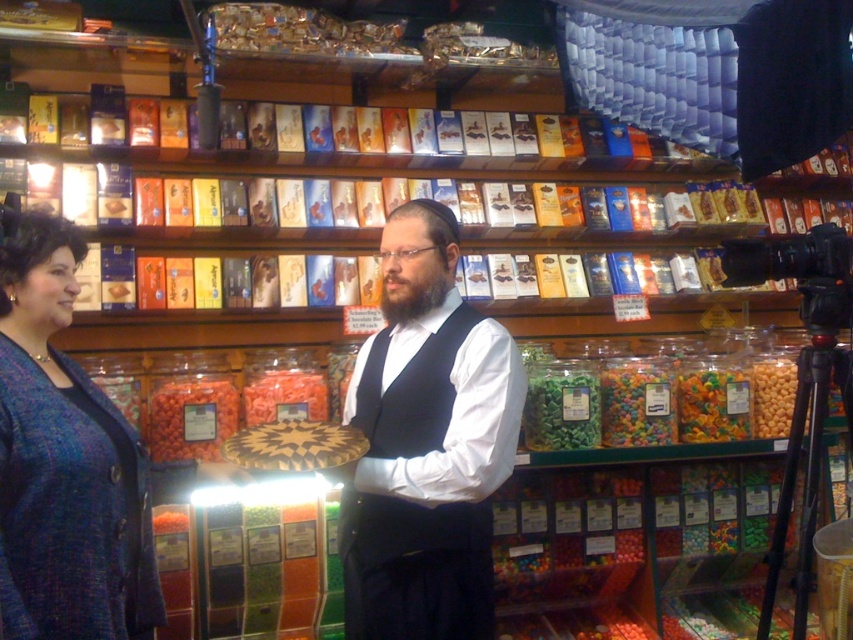
Question: Which of the following is the farthest from the observer?

Choices:
 (A) matte black vest at center
 (B) orange glossy candy at center
 (C) white matte vest at center
 (D) translucent plastic gummy bears at center

Answer: (D)

Question: Does orange glossy candy at center have a larger size compared to translucent plastic gummy bears at center?

Choices:
 (A) yes
 (B) no

Answer: (A)

Question: Which object is positioned closest to the matte black vest at center?

Choices:
 (A) translucent orange gummy bears at center
 (B) green matte gummy bears at center
 (C) translucent plastic gummy bears at center

Answer: (A)

Question: Which point appears farthest from the camera in this image?

Choices:
 (A) (416, 508)
 (B) (285, 392)

Answer: (B)

Question: Can you confirm if matte black vest at center is bigger than orange glossy candy at center?

Choices:
 (A) yes
 (B) no

Answer: (A)

Question: Can you confirm if blue textured sweater at left is bigger than black metal tripod at right?

Choices:
 (A) no
 (B) yes

Answer: (B)